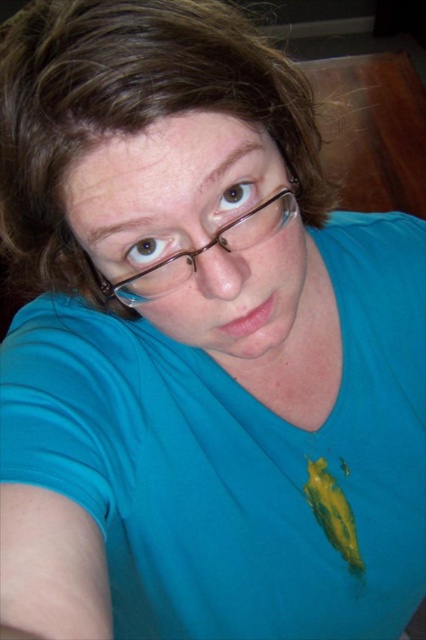
Between brownhair at center and clear plastic glasses at center, which one has less height?

Standing shorter between the two is clear plastic glasses at center.

Is point (317, 140) less distant than point (160, 276)?

No, it is behind (160, 276).

What do you see at coordinates (129, 108) in the screenshot? I see `brownhair at center` at bounding box center [129, 108].

At what (x,y) coordinates should I click in order to perform the action: click on brownhair at center. Please return your answer as a coordinate pair (x, y). Looking at the image, I should click on (129, 108).